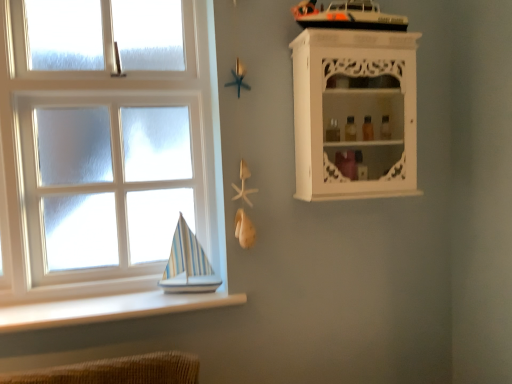
Question: Is white carved wood cabinet at upper right looking in the opposite direction of white wooden window at lower left?

Choices:
 (A) yes
 (B) no

Answer: (B)

Question: Is white carved wood cabinet at upper right not within white wooden window at lower left?

Choices:
 (A) no
 (B) yes

Answer: (B)

Question: Is white carved wood cabinet at upper right taller than white wooden window at lower left?

Choices:
 (A) no
 (B) yes

Answer: (A)

Question: From a real-world perspective, is white carved wood cabinet at upper right located beneath white wooden window at lower left?

Choices:
 (A) no
 (B) yes

Answer: (A)

Question: Considering the relative sizes of white carved wood cabinet at upper right and white wooden window at lower left in the image provided, is white carved wood cabinet at upper right shorter than white wooden window at lower left?

Choices:
 (A) yes
 (B) no

Answer: (A)

Question: From the image's perspective, is white carved wood cabinet at upper right beneath white wooden window at lower left?

Choices:
 (A) no
 (B) yes

Answer: (A)

Question: Considering the relative sizes of white wooden window at lower left and white carved wood cabinet at upper right in the image provided, is white wooden window at lower left wider than white carved wood cabinet at upper right?

Choices:
 (A) no
 (B) yes

Answer: (A)

Question: Can you confirm if white wooden window at lower left is shorter than white carved wood cabinet at upper right?

Choices:
 (A) no
 (B) yes

Answer: (A)

Question: From the image's perspective, is white wooden window at lower left on top of white carved wood cabinet at upper right?

Choices:
 (A) no
 (B) yes

Answer: (A)

Question: Does white wooden window at lower left have a larger size compared to white carved wood cabinet at upper right?

Choices:
 (A) yes
 (B) no

Answer: (A)

Question: Is white wooden window at lower left next to white carved wood cabinet at upper right and touching it?

Choices:
 (A) yes
 (B) no

Answer: (B)

Question: Is white wooden window at lower left looking in the opposite direction of white carved wood cabinet at upper right?

Choices:
 (A) no
 (B) yes

Answer: (A)

Question: Considering the relative sizes of white smooth ledge at lower left and white carved wood cabinet at upper right in the image provided, is white smooth ledge at lower left shorter than white carved wood cabinet at upper right?

Choices:
 (A) yes
 (B) no

Answer: (A)